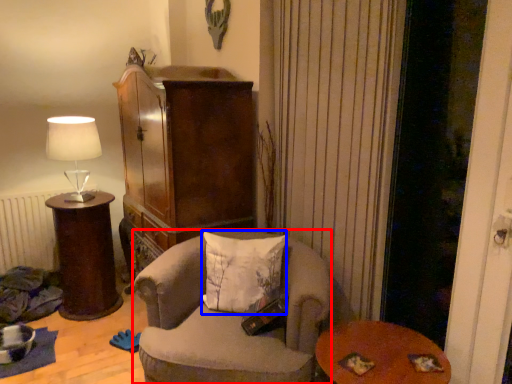
Question: Among these objects, which one is farthest to the camera, chair (highlighted by a red box) or pillow (highlighted by a blue box)?

Choices:
 (A) chair
 (B) pillow

Answer: (B)